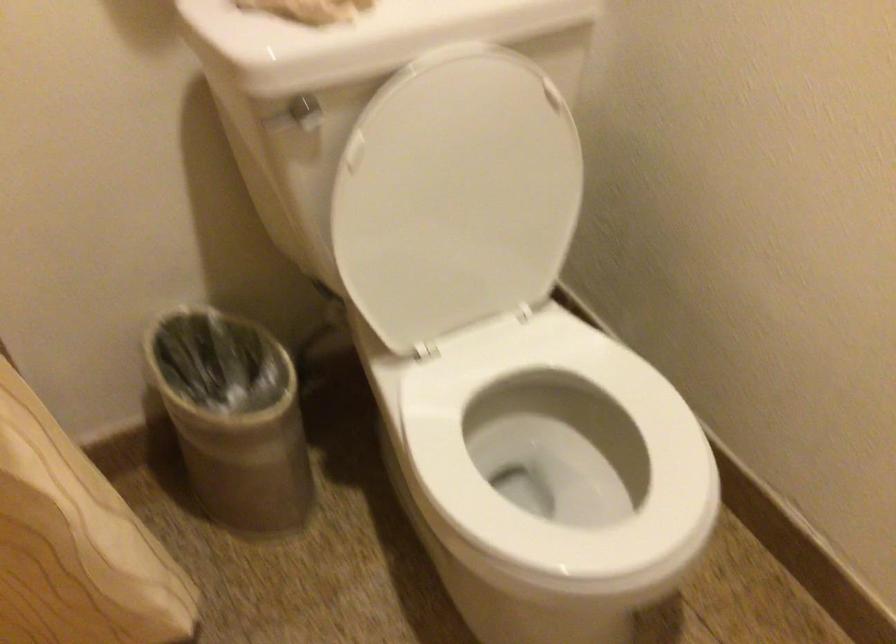
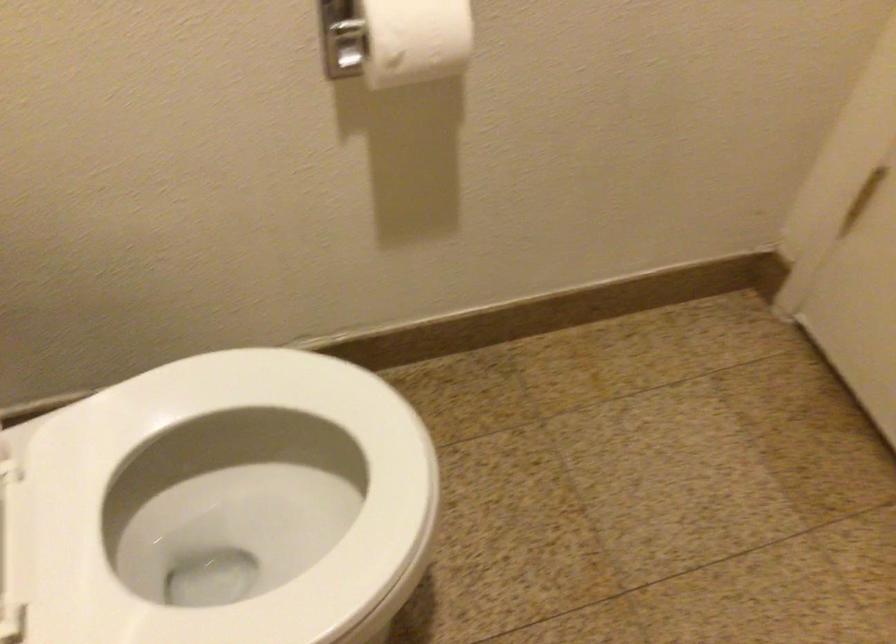
The images are taken continuously from a first-person perspective. In which direction is your viewpoint rotating?

The camera rotated toward right-down.